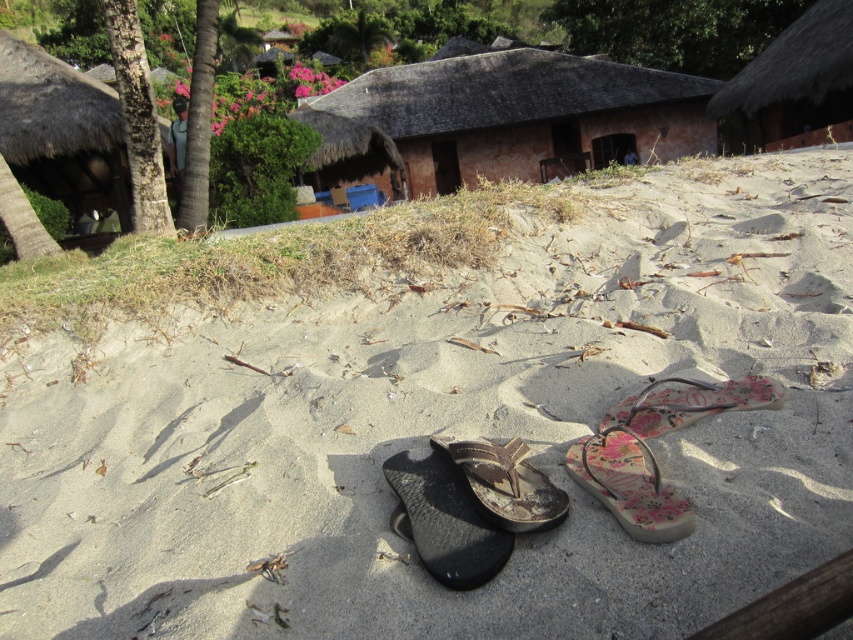
Question: Among these points, which one is farthest from the camera?

Choices:
 (A) (474, 525)
 (B) (482, 468)
 (C) (798, 22)

Answer: (C)

Question: Which object is closer to the camera taking this photo?

Choices:
 (A) floral fabric flip-flop at center-right
 (B) brown thatched hut at upper center
 (C) black rubber flip-flop at center
 (D) thatched roof hut at upper right

Answer: (C)

Question: Is brown thatched hut at upper center wider than brown leather flip-flop at center?

Choices:
 (A) yes
 (B) no

Answer: (A)

Question: Does brown leather flip-flop at center appear on the left side of floral fabric flip-flop at center?

Choices:
 (A) no
 (B) yes

Answer: (B)

Question: Which of the following is the closest to the observer?

Choices:
 (A) (769, 96)
 (B) (457, 83)
 (C) (641, 538)
 (D) (732, 400)

Answer: (C)

Question: Is brown thatched hut at upper center to the left of floral fabric flip-flop at center-right from the viewer's perspective?

Choices:
 (A) no
 (B) yes

Answer: (A)